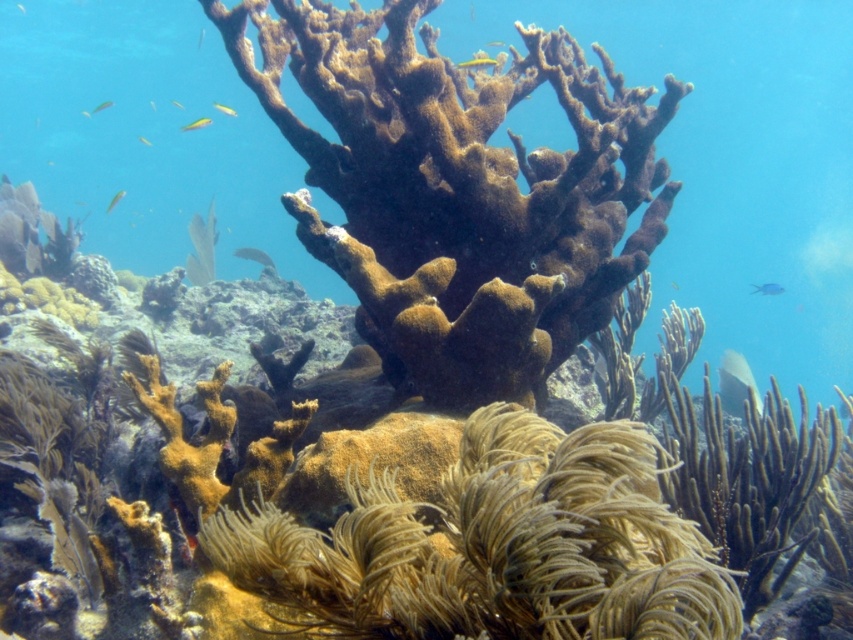
Which is behind, point (263, 260) or point (142, 138)?

The point (142, 138) is more distant.

Can you confirm if translucent rubber fish at center is shorter than translucent yellow fish at upper left?

Correct, translucent rubber fish at center is not as tall as translucent yellow fish at upper left.

At what (x,y) coordinates should I click in order to perform the action: click on translucent rubber fish at center. Please return your answer as a coordinate pair (x, y). Looking at the image, I should click on (254, 256).

The height and width of the screenshot is (640, 853). In order to click on translucent rubber fish at center in this screenshot , I will do `click(254, 256)`.

Is point (103, 102) closer to viewer compared to point (143, 136)?

Yes, it is.

The width and height of the screenshot is (853, 640). What do you see at coordinates (102, 106) in the screenshot?
I see `translucent green fish at upper left` at bounding box center [102, 106].

Is point (103, 106) farther from viewer compared to point (144, 141)?

No, it is not.

This screenshot has height=640, width=853. Find the location of `translucent green fish at upper left`. translucent green fish at upper left is located at coordinates (102, 106).

Between brown coral at center and translucent yellow fish at center, which one has more height?

With more height is brown coral at center.

In the scene shown: Between brown coral at center and translucent yellow fish at center, which one appears on the right side from the viewer's perspective?

Positioned to the right is brown coral at center.

Is point (288, 273) closer to viewer compared to point (183, 108)?

No, it is not.

Identify the location of brown coral at center. This screenshot has height=640, width=853. (732, 163).